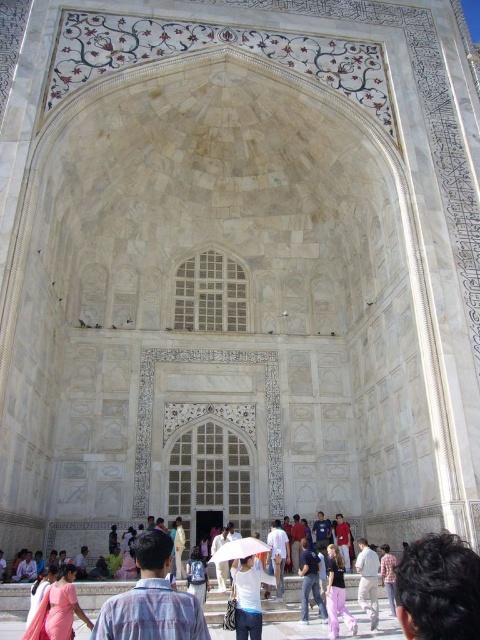
Question: Does white cotton shirt at center have a lesser width compared to plaid shirt at center?

Choices:
 (A) yes
 (B) no

Answer: (B)

Question: Can you confirm if dark brown hair at lower right is smaller than white matte shirt at center?

Choices:
 (A) yes
 (B) no

Answer: (B)

Question: Where is dark brown hair at lower right located in relation to pink fabric pants at lower center in the image?

Choices:
 (A) above
 (B) below

Answer: (A)

Question: Among these points, which one is farthest from the camera?

Choices:
 (A) (440, 588)
 (B) (383, 570)
 (C) (336, 561)
 (D) (251, 600)

Answer: (B)

Question: Estimate the real-world distances between objects in this image. Which object is farther from the white matte shirt at center?

Choices:
 (A) dark brown hair at lower right
 (B) plaid shirt at center
 (C) pink fabric pants at lower center
 (D) white cotton shirt at center

Answer: (A)

Question: Which object is the closest to the white matte shirt at center?

Choices:
 (A) plaid shirt at center
 (B) dark brown hair at lower right

Answer: (A)